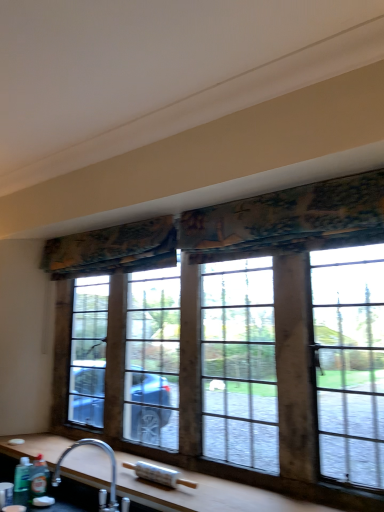
Question: In which direction should I rotate to look at textured floral fabric at upper center, placed as the first curtain when sorted from front to back?

Choices:
 (A) right
 (B) left

Answer: (A)

Question: Considering the relative sizes of green matte bottle at lower left, the 1th bottle positioned from the right, and wooden at lower center in the image provided, is green matte bottle at lower left, the 1th bottle positioned from the right, taller than wooden at lower center?

Choices:
 (A) yes
 (B) no

Answer: (A)

Question: From the image's perspective, is green matte bottle at lower left, the 1th bottle positioned from the right, above wooden at lower center?

Choices:
 (A) no
 (B) yes

Answer: (A)

Question: Can you confirm if green matte bottle at lower left, the 1th bottle positioned from the right, is smaller than wooden at lower center?

Choices:
 (A) yes
 (B) no

Answer: (A)

Question: Would you say green matte bottle at lower left, the 1th bottle positioned from the right, is outside wooden at lower center?

Choices:
 (A) no
 (B) yes

Answer: (B)

Question: Is green matte bottle at lower left, the second bottle from the left, wider than wooden at lower center?

Choices:
 (A) no
 (B) yes

Answer: (A)

Question: Considering the relative sizes of green matte bottle at lower left, the 1th bottle positioned from the right, and wooden at lower center in the image provided, is green matte bottle at lower left, the 1th bottle positioned from the right, shorter than wooden at lower center?

Choices:
 (A) no
 (B) yes

Answer: (A)

Question: Does textured fabric curtain at upper center, arranged as the first curtain when viewed from the left, have a greater width compared to silver metallic faucet at lower left?

Choices:
 (A) yes
 (B) no

Answer: (B)

Question: From a real-world perspective, is textured fabric curtain at upper center, positioned as the 2th curtain in front-to-back order, located higher than silver metallic faucet at lower left?

Choices:
 (A) no
 (B) yes

Answer: (B)

Question: From the image's perspective, is textured fabric curtain at upper center, the first curtain when ordered from back to front, over silver metallic faucet at lower left?

Choices:
 (A) yes
 (B) no

Answer: (A)

Question: Is textured fabric curtain at upper center, arranged as the first curtain when viewed from the left, taller than silver metallic faucet at lower left?

Choices:
 (A) yes
 (B) no

Answer: (B)

Question: Can you confirm if textured fabric curtain at upper center, which appears as the second curtain when viewed from the right, is shorter than silver metallic faucet at lower left?

Choices:
 (A) no
 (B) yes

Answer: (B)

Question: Is there a large distance between textured fabric curtain at upper center, arranged as the first curtain when viewed from the left, and silver metallic faucet at lower left?

Choices:
 (A) yes
 (B) no

Answer: (A)

Question: Does wooden at lower center have a greater height compared to wooden-framed window at center?

Choices:
 (A) no
 (B) yes

Answer: (A)